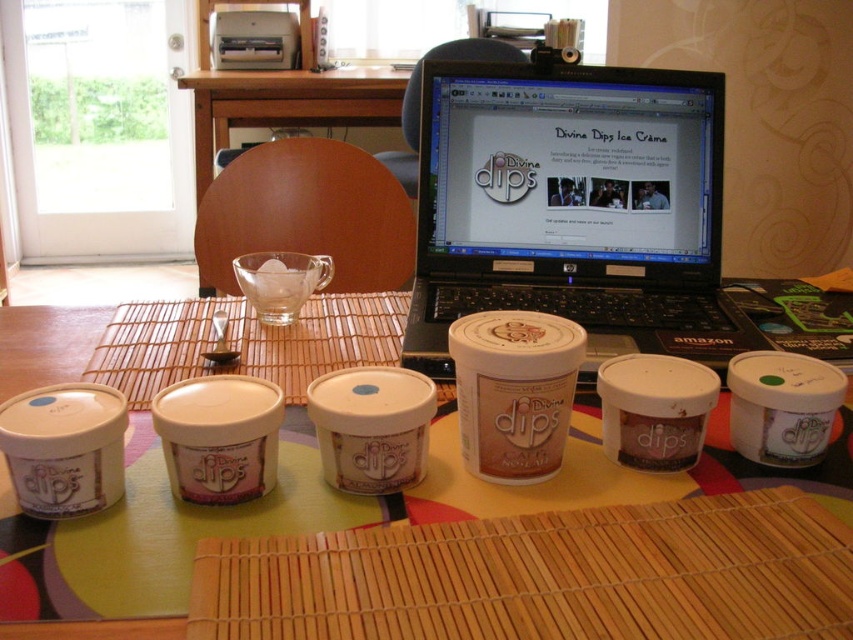
Question: Is black plastic laptop at upper center to the left of green fabric table at center from the viewer's perspective?

Choices:
 (A) no
 (B) yes

Answer: (A)

Question: Does white matte container at center have a lesser width compared to green fabric table at center?

Choices:
 (A) no
 (B) yes

Answer: (B)

Question: Which object is closer to the camera taking this photo?

Choices:
 (A) black plastic laptop at upper center
 (B) white matte container at center
 (C) green fabric table at center

Answer: (C)

Question: Which point is farther from the camera taking this photo?

Choices:
 (A) (570, 68)
 (B) (468, 340)
 (C) (129, 269)

Answer: (C)

Question: Can you confirm if white matte container at center is wider than green fabric table at center?

Choices:
 (A) yes
 (B) no

Answer: (B)

Question: Which point appears farthest from the camera in this image?

Choices:
 (A) (445, 392)
 (B) (491, 378)
 (C) (722, 344)

Answer: (C)